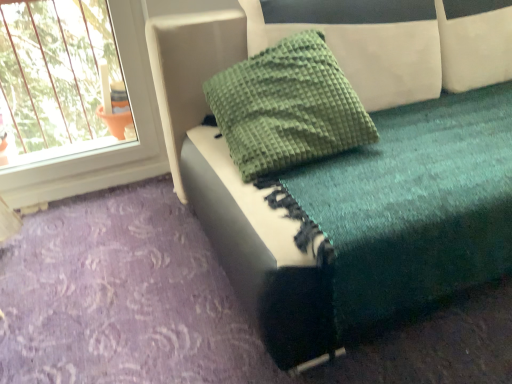
Question: Is the position of teal fabric cushion at upper center less distant than that of green textured pillow at upper center?

Choices:
 (A) no
 (B) yes

Answer: (B)

Question: Does teal fabric cushion at upper center have a lesser width compared to green textured pillow at upper center?

Choices:
 (A) no
 (B) yes

Answer: (A)

Question: From a real-world perspective, is teal fabric cushion at upper center over green textured pillow at upper center?

Choices:
 (A) yes
 (B) no

Answer: (B)

Question: Is teal fabric cushion at upper center turned away from green textured pillow at upper center?

Choices:
 (A) no
 (B) yes

Answer: (B)

Question: Considering the relative sizes of teal fabric cushion at upper center and green textured pillow at upper center in the image provided, is teal fabric cushion at upper center bigger than green textured pillow at upper center?

Choices:
 (A) yes
 (B) no

Answer: (A)

Question: Does teal fabric cushion at upper center have a smaller size compared to green textured pillow at upper center?

Choices:
 (A) no
 (B) yes

Answer: (A)

Question: From a real-world perspective, is green textured pillow at upper center over teal fabric cushion at upper center?

Choices:
 (A) yes
 (B) no

Answer: (A)

Question: Is the surface of green textured pillow at upper center in direct contact with teal fabric cushion at upper center?

Choices:
 (A) yes
 (B) no

Answer: (B)

Question: Can you confirm if green textured pillow at upper center is wider than teal fabric cushion at upper center?

Choices:
 (A) no
 (B) yes

Answer: (A)

Question: Does green textured pillow at upper center lie in front of teal fabric cushion at upper center?

Choices:
 (A) no
 (B) yes

Answer: (A)

Question: Does green textured pillow at upper center appear on the right side of teal fabric cushion at upper center?

Choices:
 (A) no
 (B) yes

Answer: (A)

Question: Considering the relative sizes of green textured pillow at upper center and teal fabric cushion at upper center in the image provided, is green textured pillow at upper center shorter than teal fabric cushion at upper center?

Choices:
 (A) no
 (B) yes

Answer: (B)

Question: Would you say green textured pillow at upper center is to the left or to the right of teal fabric cushion at upper center in the picture?

Choices:
 (A) left
 (B) right

Answer: (A)